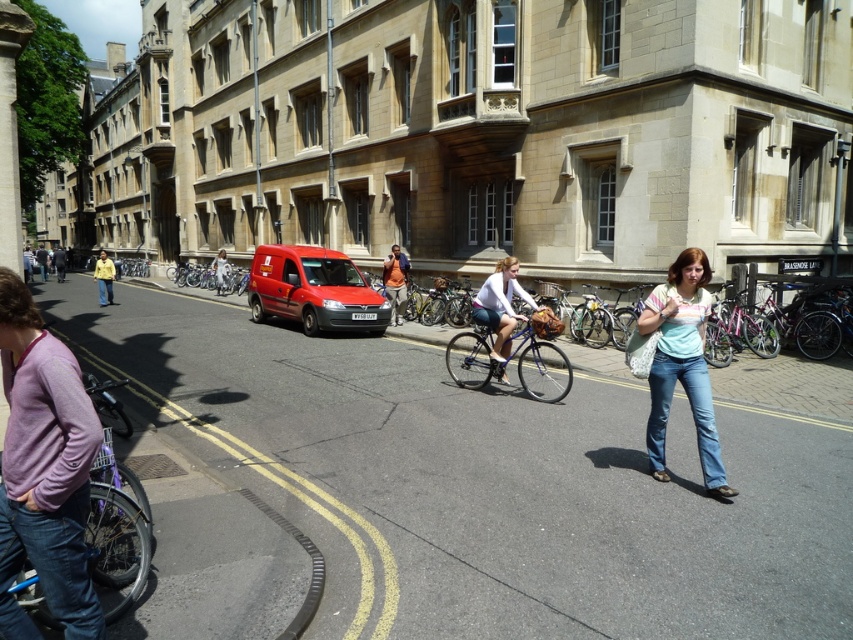
Question: Is light blue denim jeans at center bigger than yellow fabric jacket at center?

Choices:
 (A) yes
 (B) no

Answer: (B)

Question: Which object is positioned farthest from the light blue denim jeans at center?

Choices:
 (A) light blue jeans at center
 (B) matte white bicycle at center
 (C) blue metallic bicycle at center
 (D) matte red van at center

Answer: (A)

Question: Which object is positioned farthest from the light blue denim jeans at center?

Choices:
 (A) yellow fabric jacket at center
 (B) blue metallic bicycle at center
 (C) matte red van at center

Answer: (A)

Question: Which of the following is the farthest from the observer?

Choices:
 (A) (393, 244)
 (B) (218, 284)
 (C) (99, 296)

Answer: (B)

Question: Does light blue denim jeans at center have a larger size compared to light blue jeans at center?

Choices:
 (A) no
 (B) yes

Answer: (B)

Question: Can you confirm if light blue denim jeans at center is smaller than orange shirt at center?

Choices:
 (A) no
 (B) yes

Answer: (B)